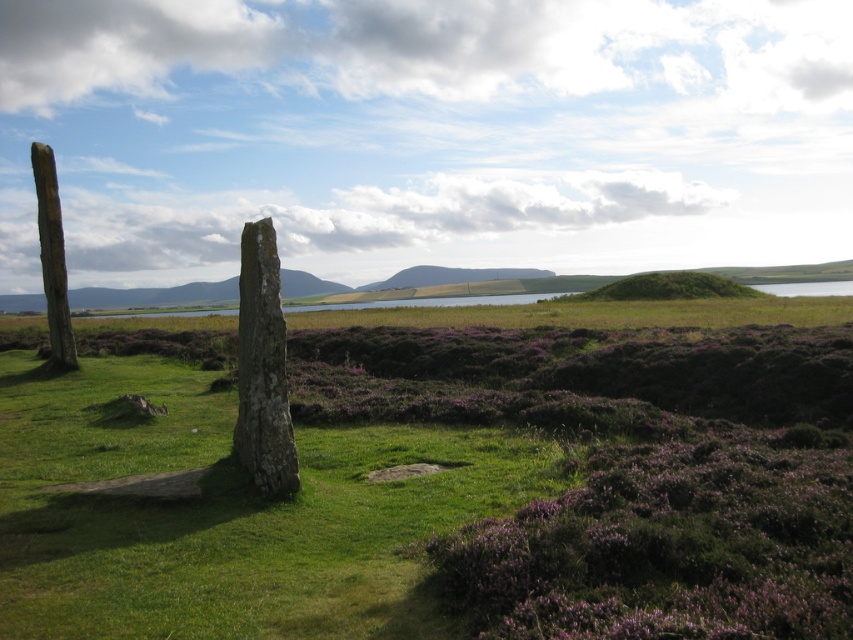
Does green mossy stone at center have a smaller size compared to smooth wooden pole at left?

Yes, green mossy stone at center is smaller than smooth wooden pole at left.

The width and height of the screenshot is (853, 640). Describe the element at coordinates (262, 368) in the screenshot. I see `green mossy stone at center` at that location.

What do you see at coordinates (262, 368) in the screenshot? This screenshot has width=853, height=640. I see `green mossy stone at center` at bounding box center [262, 368].

In order to click on green mossy stone at center in this screenshot , I will do `click(262, 368)`.

Does green grassy at center have a smaller size compared to smooth wooden pole at left?

Incorrect, green grassy at center is not smaller in size than smooth wooden pole at left.

What do you see at coordinates (223, 515) in the screenshot? The image size is (853, 640). I see `green grassy at center` at bounding box center [223, 515].

Is point (184, 630) positioned after point (57, 362)?

No.

Find the location of a particular element. This screenshot has height=640, width=853. green grassy at center is located at coordinates (223, 515).

Who is shorter, green grassy at center or green mossy stone at center?

green grassy at center is shorter.

Who is more distant from viewer, (405, 513) or (262, 406)?

Positioned behind is point (262, 406).

The height and width of the screenshot is (640, 853). Describe the element at coordinates (223, 515) in the screenshot. I see `green grassy at center` at that location.

At what (x,y) coordinates should I click in order to perform the action: click on green grassy at center. Please return your answer as a coordinate pair (x, y). Image resolution: width=853 pixels, height=640 pixels. Looking at the image, I should click on (223, 515).